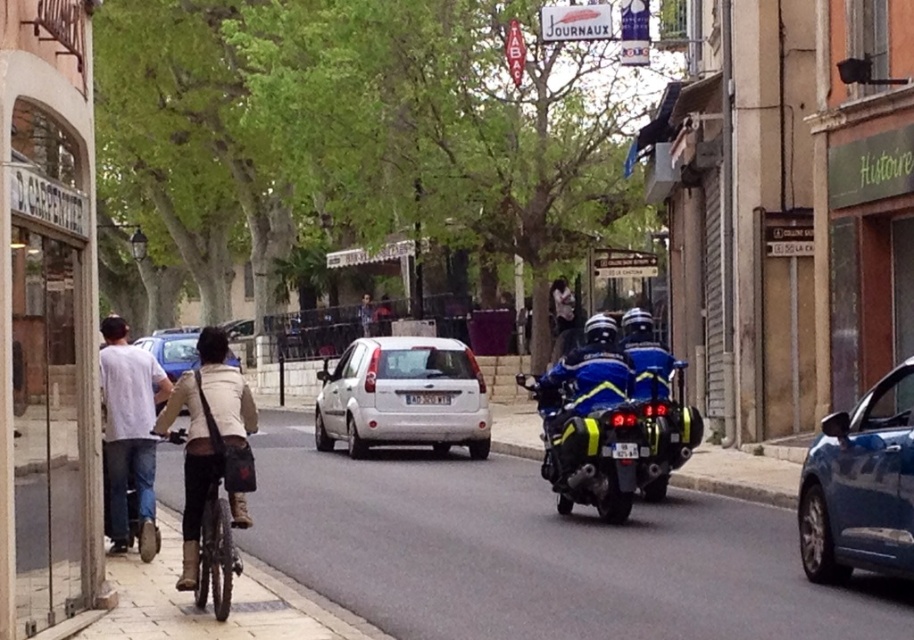
Question: Is blue metallic car at right bigger than blue matte car at center?

Choices:
 (A) no
 (B) yes

Answer: (A)

Question: Is blue metallic car at right closer to camera compared to blue matte car at center?

Choices:
 (A) yes
 (B) no

Answer: (A)

Question: Which object is positioned farthest from the blue matte car at center?

Choices:
 (A) blue metallic car at right
 (B) smooth concrete sidewalk at lower left

Answer: (A)

Question: Which of these objects is positioned closest to the blue metallic car at right?

Choices:
 (A) metallic silver bicycle at center
 (B) white matte hatchback at center
 (C) blue glossy motorcycle at center

Answer: (C)

Question: Is the position of blue metallic car at right more distant than that of white matte hatchback at center?

Choices:
 (A) yes
 (B) no

Answer: (B)

Question: Considering the real-world distances, which object is farthest from the blue metallic car at right?

Choices:
 (A) white matte hatchback at center
 (B) smooth concrete sidewalk at lower left
 (C) blue glossy motorcycle at center

Answer: (A)